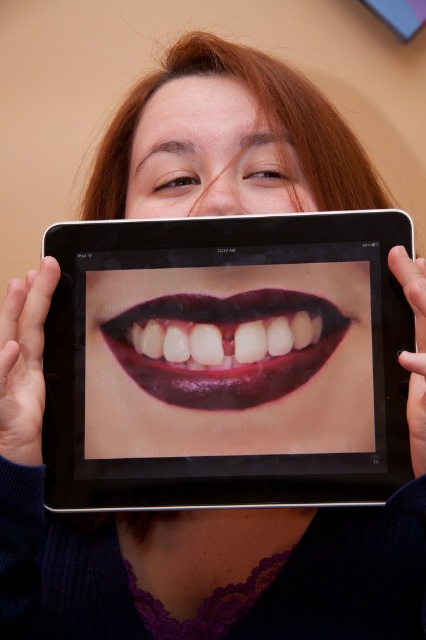
Is black glossy tablet at center further to the viewer compared to smooth skin at center?

No, it is not.

Measure the distance between black glossy tablet at center and smooth skin at center.

12.88 centimeters

This screenshot has height=640, width=426. In order to click on black glossy tablet at center in this screenshot , I will do `click(227, 362)`.

What do you see at coordinates (227, 362) in the screenshot?
I see `black glossy tablet at center` at bounding box center [227, 362].

Is black glossy tablet at center below shiny dark red lips at center?

Yes.

Does point (92, 314) lie in front of point (181, 320)?

No, (92, 314) is behind (181, 320).

Image resolution: width=426 pixels, height=640 pixels. What are the coordinates of `black glossy tablet at center` in the screenshot? It's located at 227,362.

Does shiny dark red lips at center come in front of smooth skin at center?

Yes, shiny dark red lips at center is in front of smooth skin at center.

Can you confirm if shiny dark red lips at center is positioned above smooth skin at center?

No.

Does point (267, 365) come farther from viewer compared to point (192, 134)?

No, it is in front of (192, 134).

This screenshot has width=426, height=640. I want to click on shiny dark red lips at center, so click(x=224, y=346).